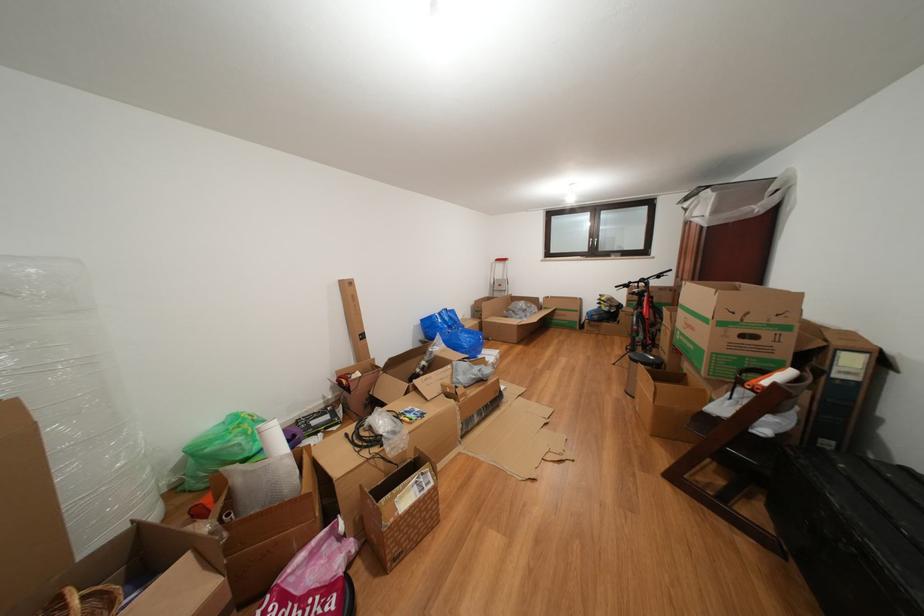
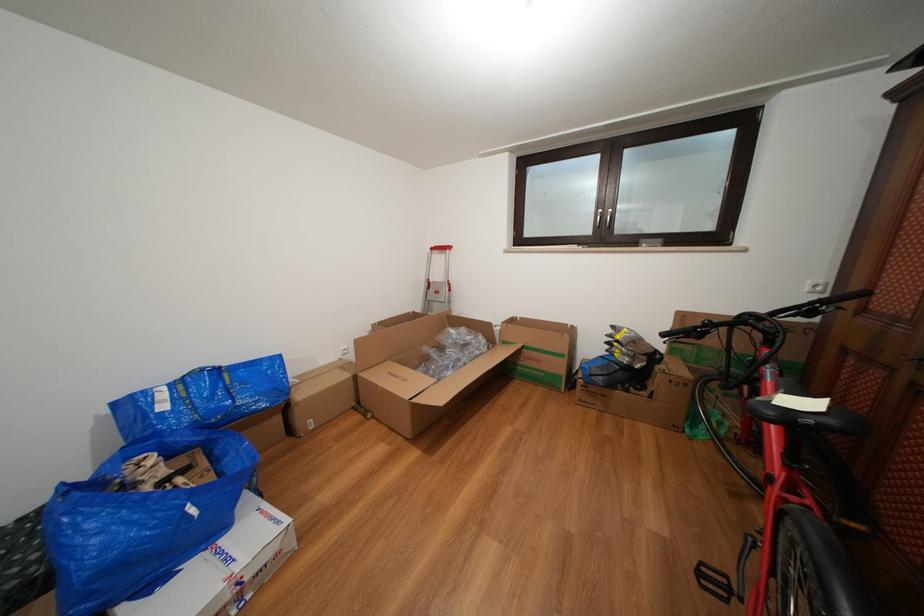
What movement of the cameraman would produce the second image?

The cameraman walked toward right, forward.